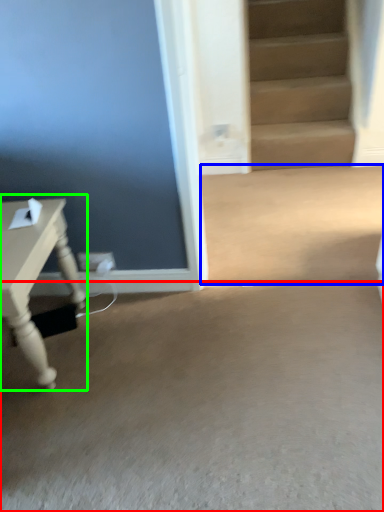
Question: Which object is the farthest from concrete (highlighted by a red box)? Choose among these: concrete (highlighted by a blue box) or table (highlighted by a green box).

Choices:
 (A) concrete
 (B) table

Answer: (A)